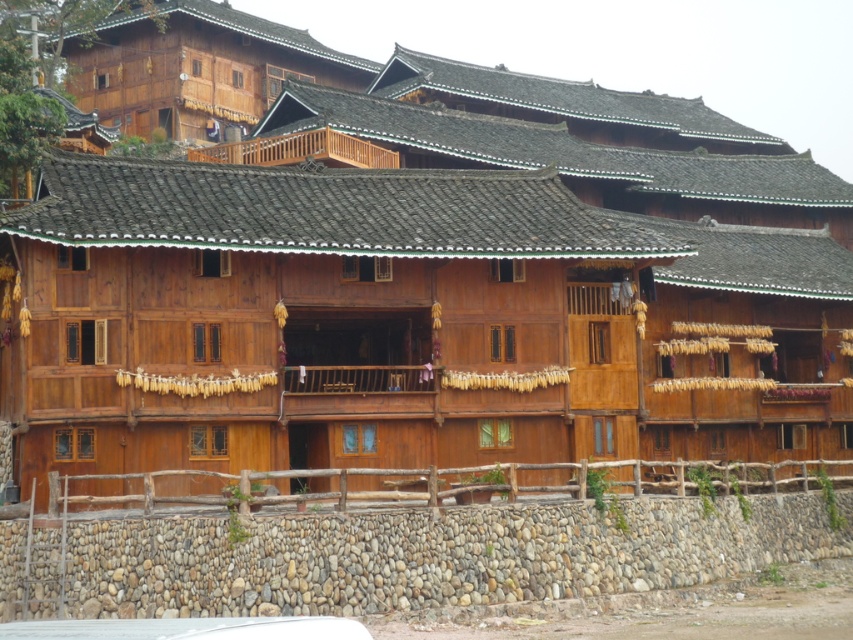
Question: Which of the following is the closest to the observer?

Choices:
 (A) (253, 628)
 (B) (317, 141)

Answer: (A)

Question: Does white matte car at lower center appear under natural wood balcony at upper center?

Choices:
 (A) no
 (B) yes

Answer: (B)

Question: Does white matte car at lower center lie behind natural wood balcony at upper center?

Choices:
 (A) no
 (B) yes

Answer: (A)

Question: Among these objects, which one is farthest from the camera?

Choices:
 (A) white matte car at lower center
 (B) natural wood balcony at upper center

Answer: (B)

Question: Does white matte car at lower center appear on the left side of natural wood balcony at upper center?

Choices:
 (A) no
 (B) yes

Answer: (A)